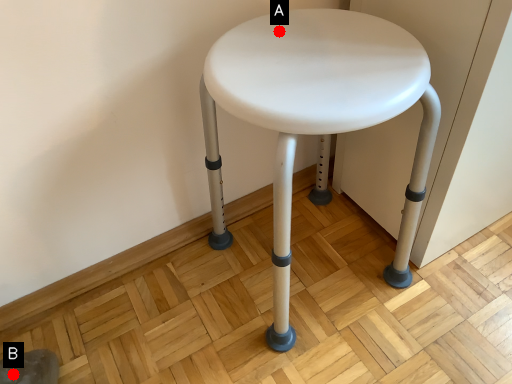
Question: Two points are circled on the image, labeled by A and B beside each circle. Among these points, which one is nearest to the camera?

Choices:
 (A) A is closer
 (B) B is closer

Answer: (A)